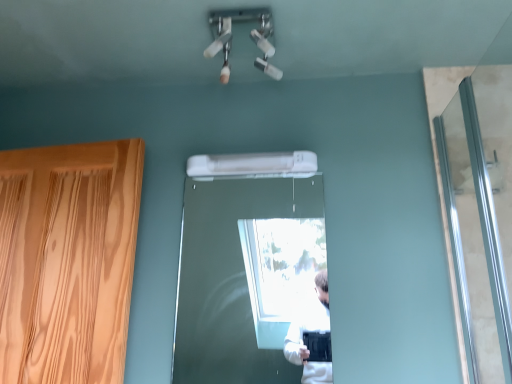
Question: Would you consider silver metallic screen door at right to be distant from wooden door at center?

Choices:
 (A) no
 (B) yes

Answer: (B)

Question: From the image's perspective, would you say silver metallic screen door at right is positioned over wooden door at center?

Choices:
 (A) no
 (B) yes

Answer: (B)

Question: Is silver metallic screen door at right oriented away from wooden door at center?

Choices:
 (A) no
 (B) yes

Answer: (A)

Question: Does silver metallic screen door at right appear on the right side of wooden door at center?

Choices:
 (A) yes
 (B) no

Answer: (A)

Question: Does silver metallic screen door at right have a larger size compared to wooden door at center?

Choices:
 (A) yes
 (B) no

Answer: (A)

Question: Considering the relative positions of silver metallic screen door at right and wooden door at center in the image provided, is silver metallic screen door at right behind wooden door at center?

Choices:
 (A) yes
 (B) no

Answer: (B)

Question: Considering the relative sizes of wooden door at center and white plastic air conditioner at center in the image provided, is wooden door at center shorter than white plastic air conditioner at center?

Choices:
 (A) no
 (B) yes

Answer: (A)

Question: Is the depth of wooden door at center greater than that of white plastic air conditioner at center?

Choices:
 (A) yes
 (B) no

Answer: (B)

Question: From the image's perspective, does wooden door at center appear higher than white plastic air conditioner at center?

Choices:
 (A) yes
 (B) no

Answer: (B)

Question: From a real-world perspective, is wooden door at center positioned under white plastic air conditioner at center based on gravity?

Choices:
 (A) yes
 (B) no

Answer: (A)

Question: Is wooden door at center outside of white plastic air conditioner at center?

Choices:
 (A) no
 (B) yes

Answer: (B)

Question: From a real-world perspective, is wooden door at center physically above white plastic air conditioner at center?

Choices:
 (A) yes
 (B) no

Answer: (B)

Question: Is white plastic air conditioner at center positioned with its back to silver metallic screen door at right?

Choices:
 (A) yes
 (B) no

Answer: (B)